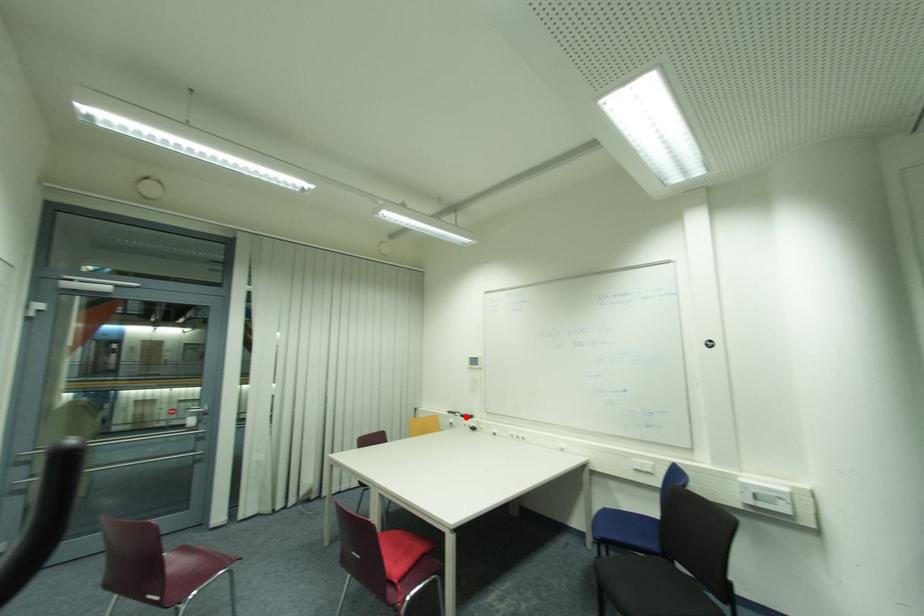
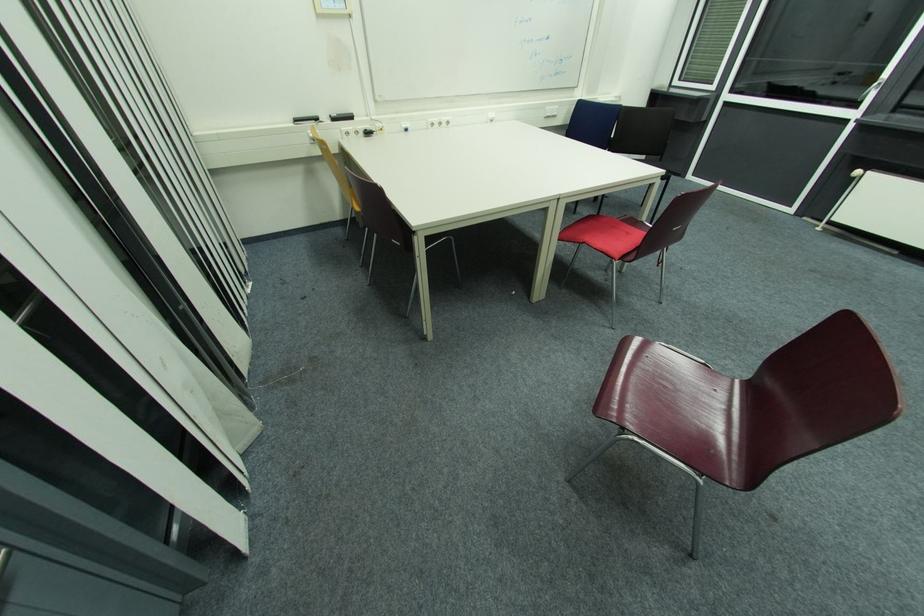
Question: I am providing you with two images of the same scene from different viewpoints. Image1 has a red point marked. In image2, the corresponding 3D location appears at what relative position? Reply with the corresponding letter.

Choices:
 (A) Closer
 (B) Farther

Answer: (A)